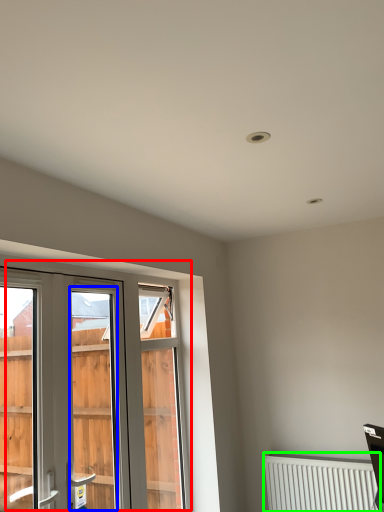
Question: Which object is the farthest from window (highlighted by a red box)? Choose among these: screen door (highlighted by a blue box) or radiator (highlighted by a green box).

Choices:
 (A) screen door
 (B) radiator

Answer: (A)